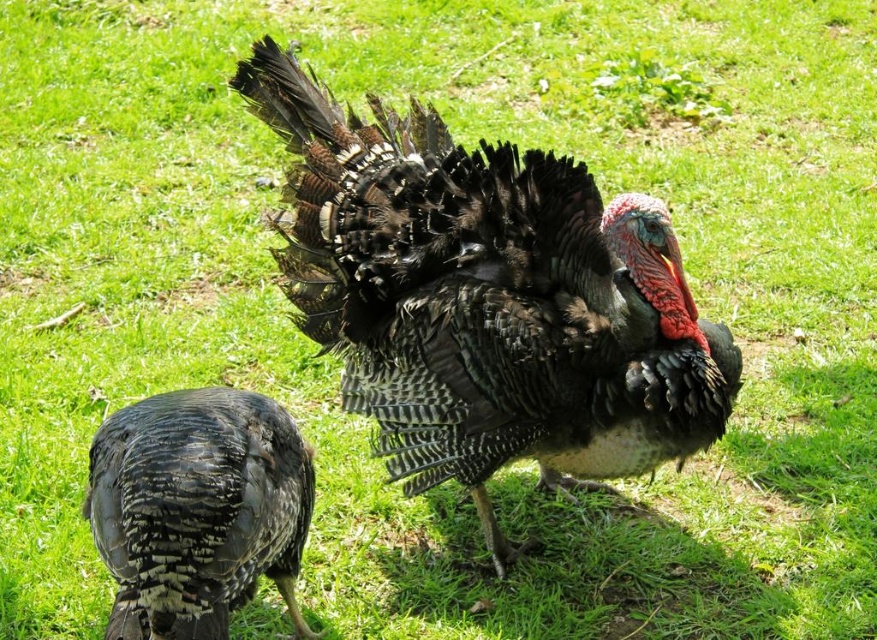
Is shiny black turkey at center thinner than shiny black feathers at lower left?

No.

Is point (676, 336) in front of point (305, 628)?

That is True.

Is point (617, 442) behind point (217, 616)?

Yes.

Locate an element on the screen. This screenshot has width=877, height=640. shiny black turkey at center is located at coordinates point(487,298).